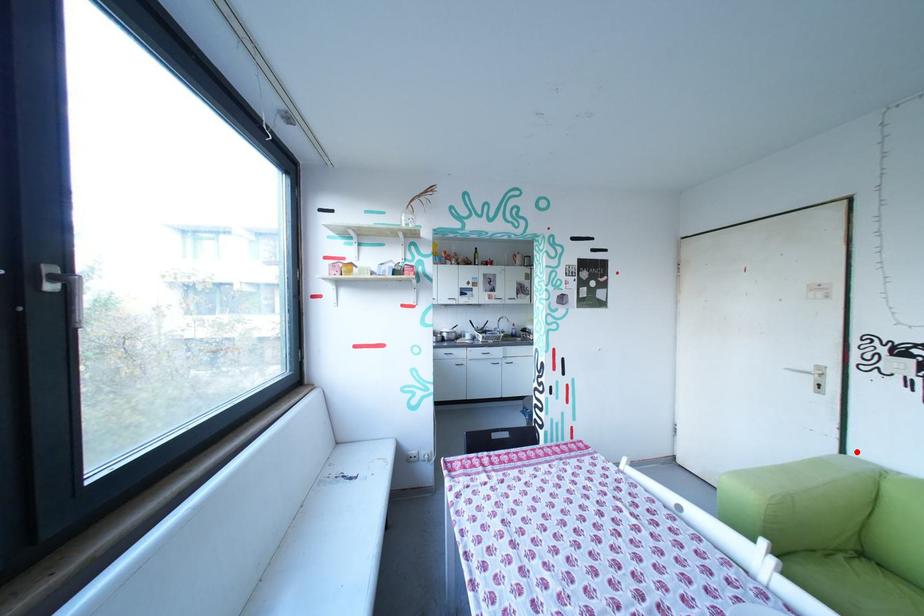
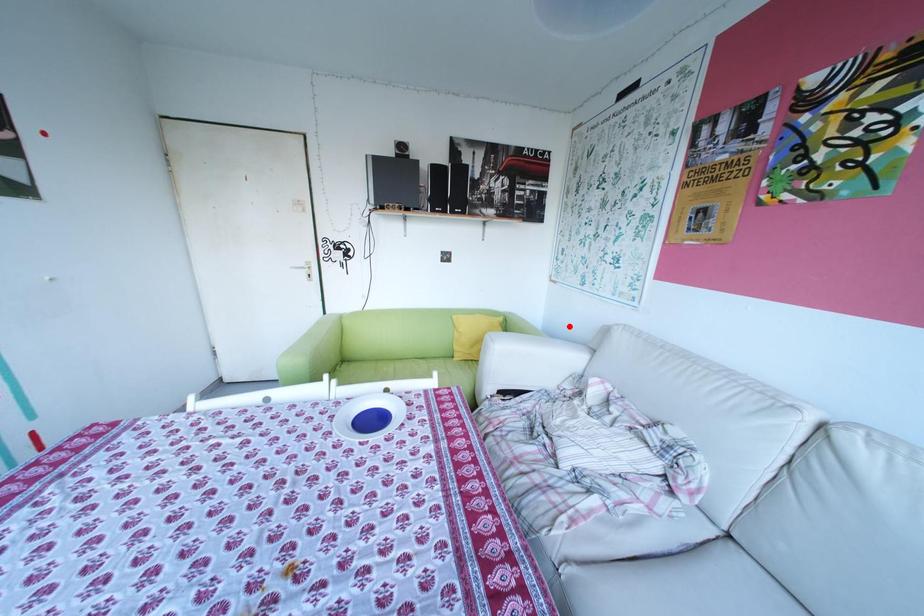
I am providing you with two images of the same scene from different viewpoints. A red point is marked on the first image and another point is marked on the second image. Do the highlighted points in image1 and image2 indicate the same real-world spot?

No